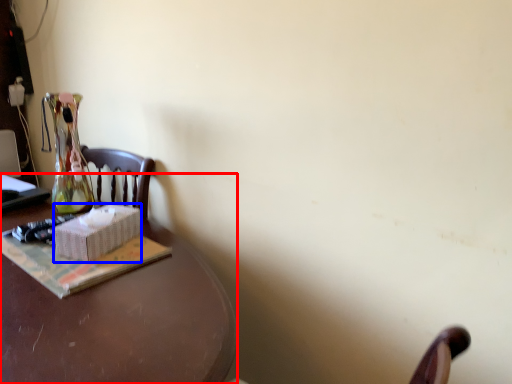
Question: Which object appears farthest to the camera in this image, desk (highlighted by a red box) or box (highlighted by a blue box)?

Choices:
 (A) desk
 (B) box

Answer: (B)